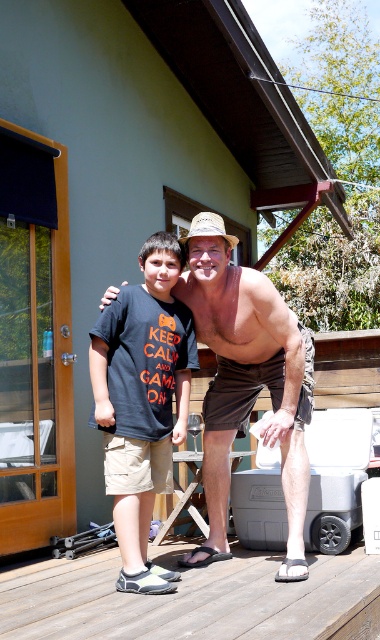
Which is behind, point (144, 600) or point (118, 362)?

The point (118, 362) is more distant.

Is point (25, 621) more distant than point (93, 364)?

No, it is in front of (93, 364).

Who is more distant from viewer, (294, 614) or (107, 413)?

Positioned behind is point (107, 413).

The width and height of the screenshot is (380, 640). What are the coordinates of `brown wooden deck at lower center` in the screenshot? It's located at pyautogui.click(x=194, y=600).

Can you confirm if brown wooden deck at lower center is shorter than brown cotton shorts at center?

Yes.

Is brown wooden deck at lower center to the left of brown cotton shorts at center from the viewer's perspective?

Yes, brown wooden deck at lower center is to the left of brown cotton shorts at center.

Does point (373, 556) lie behind point (229, 339)?

Yes, point (373, 556) is farther from viewer.

Locate an element on the screen. The height and width of the screenshot is (640, 380). brown wooden deck at lower center is located at coordinates (194, 600).

Between brown cotton shorts at center and dark gray cotton t-shirt at center, which one appears on the right side from the viewer's perspective?

From the viewer's perspective, brown cotton shorts at center appears more on the right side.

Is brown cotton shorts at center further to camera compared to dark gray cotton t-shirt at center?

That is True.

Between point (220, 292) and point (166, 275), which one is positioned behind?

Positioned behind is point (220, 292).

I want to click on brown cotton shorts at center, so click(x=247, y=380).